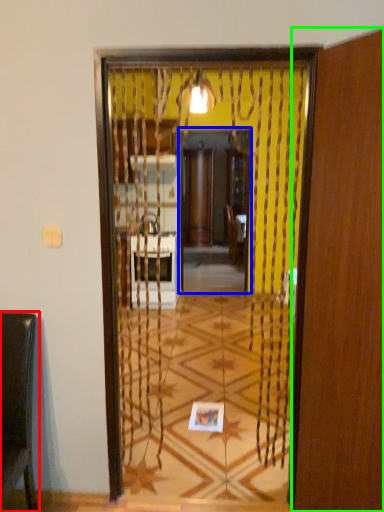
Question: Which object is the farthest from furniture (highlighted by a red box)? Choose among these: screen door (highlighted by a blue box) or screen door (highlighted by a green box).

Choices:
 (A) screen door
 (B) screen door

Answer: (A)